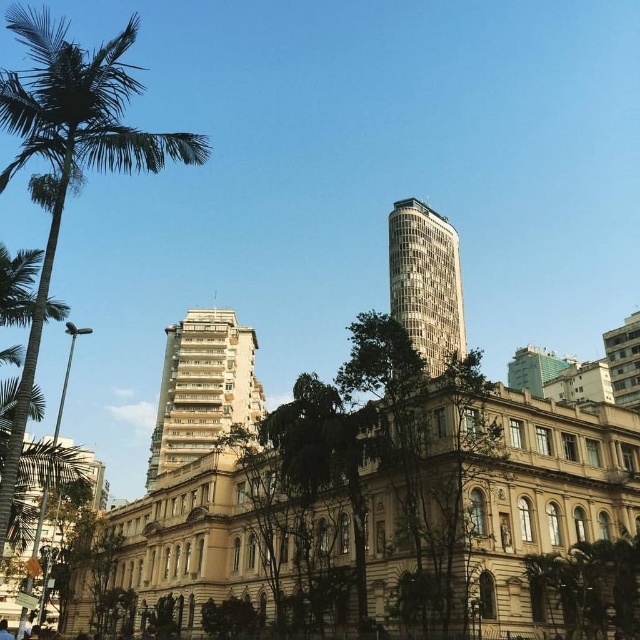
Question: Considering the real-world distances, which object is closest to the green leafy tree at center?

Choices:
 (A) gray concrete building at upper right
 (B) green leafy palm tree at left
 (C) white textured building at center

Answer: (B)

Question: Can you confirm if green leafy tree at center is wider than gray concrete building at upper right?

Choices:
 (A) yes
 (B) no

Answer: (B)

Question: Considering the real-world distances, which object is farthest from the green leafy palm tree at left?

Choices:
 (A) green leafy tree at lower right
 (B) silver glass tower at upper right
 (C) gray concrete building at upper right

Answer: (C)

Question: Considering the real-world distances, which object is closest to the green leafy tree at center?

Choices:
 (A) silver glass tower at upper right
 (B) green leafy tree at lower right

Answer: (B)

Question: Where is silver glass tower at upper right located in relation to gray concrete building at upper right in the image?

Choices:
 (A) right
 (B) left

Answer: (B)

Question: Can you confirm if green leafy tree at center is positioned to the left of white textured building at center?

Choices:
 (A) yes
 (B) no

Answer: (B)